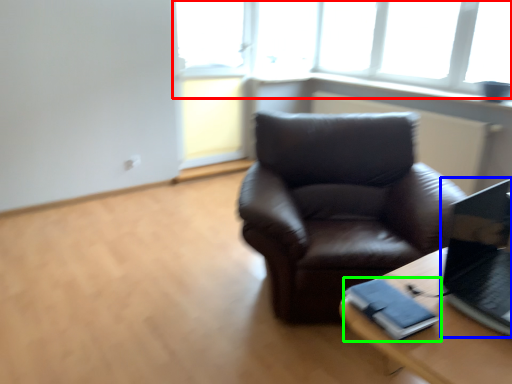
Question: Which object is positioned closest to window (highlighted by a red box)? Select from laptop (highlighted by a blue box) and binder (highlighted by a green box).

Choices:
 (A) laptop
 (B) binder

Answer: (A)